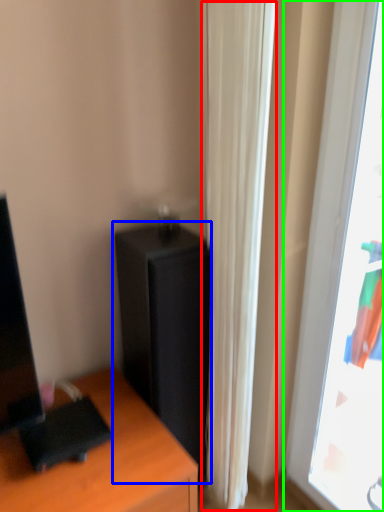
Question: Estimate the real-world distances between objects in this image. Which object is farther from curtain (highlighted by a red box), file cabinet (highlighted by a blue box) or window (highlighted by a green box)?

Choices:
 (A) file cabinet
 (B) window

Answer: (B)